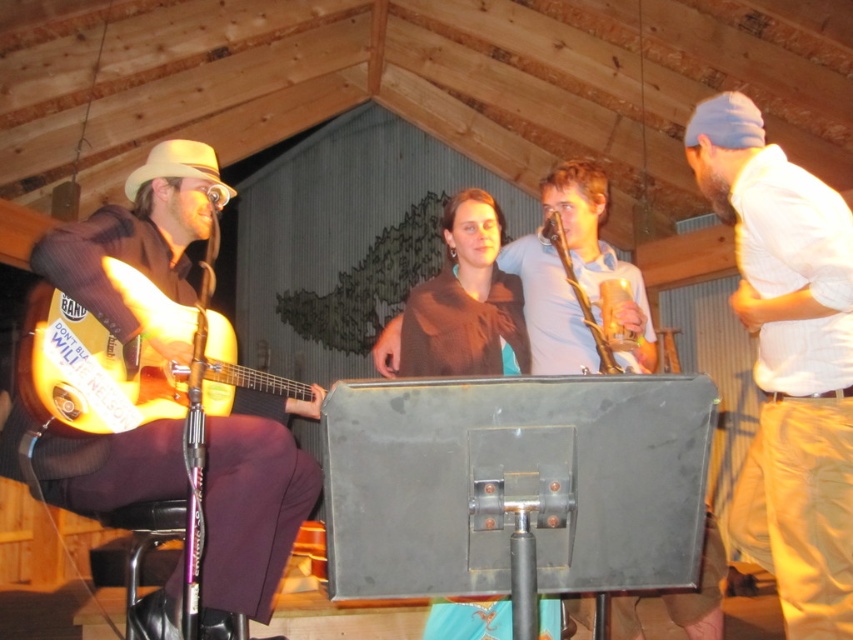
Does white cotton shirt at right have a greater height compared to matte brown guitar at left?

Yes.

Describe the element at coordinates (788, 362) in the screenshot. I see `white cotton shirt at right` at that location.

The height and width of the screenshot is (640, 853). Find the location of `white cotton shirt at right`. white cotton shirt at right is located at coordinates (788, 362).

Image resolution: width=853 pixels, height=640 pixels. What do you see at coordinates (788, 362) in the screenshot?
I see `white cotton shirt at right` at bounding box center [788, 362].

This screenshot has height=640, width=853. What do you see at coordinates (788, 362) in the screenshot?
I see `white cotton shirt at right` at bounding box center [788, 362].

Where is `white cotton shirt at right`? white cotton shirt at right is located at coordinates (788, 362).

In the scene shown: Who is positioned more to the left, matte brown guitar at left or shiny orange electric guitar at left?

matte brown guitar at left

Is matte brown guitar at left wider than shiny orange electric guitar at left?

Indeed, matte brown guitar at left has a greater width compared to shiny orange electric guitar at left.

Between point (292, 525) and point (164, 400), which one is positioned in front?

Point (164, 400)

Locate an element on the screen. This screenshot has width=853, height=640. matte brown guitar at left is located at coordinates [254, 500].